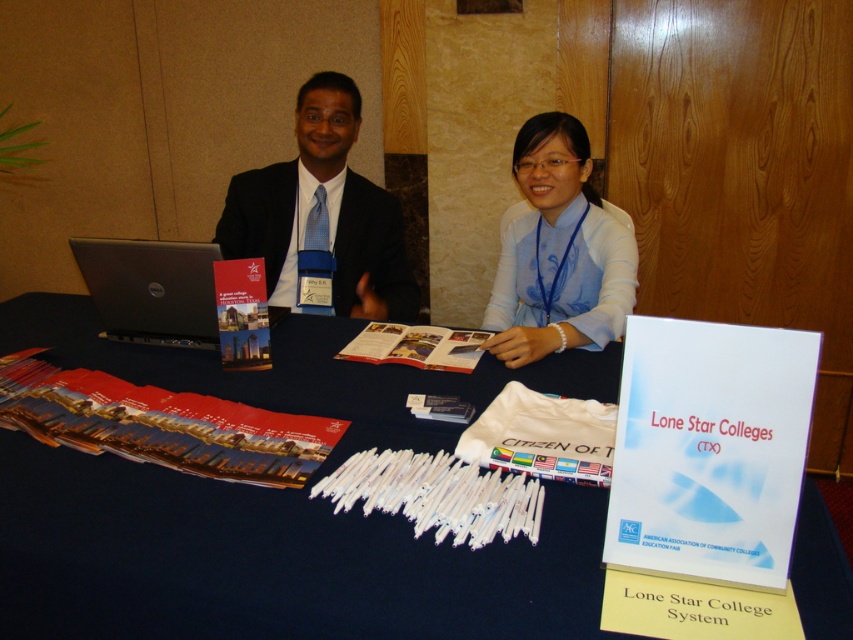
Question: Which point is farther to the camera?

Choices:
 (A) (113, 490)
 (B) (537, 240)

Answer: (B)

Question: Which of the following is the farthest from the observer?

Choices:
 (A) (357, 289)
 (B) (346, 182)

Answer: (B)

Question: From the image, what is the correct spatial relationship of matte black suit at center in relation to blue silk blouse at center?

Choices:
 (A) below
 (B) above

Answer: (B)

Question: Is blue fabric shirt at center positioned before blue silk blouse at center?

Choices:
 (A) yes
 (B) no

Answer: (B)

Question: Which point is closer to the camera taking this photo?

Choices:
 (A) (602, 502)
 (B) (183, 253)
 (C) (334, 140)
 (D) (582, 166)

Answer: (A)

Question: Is the position of blue fabric table at center less distant than that of blue fabric shirt at center?

Choices:
 (A) yes
 (B) no

Answer: (A)